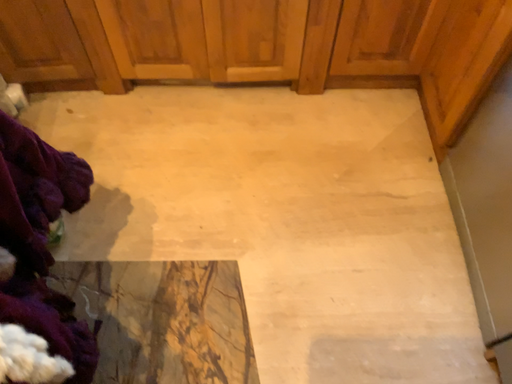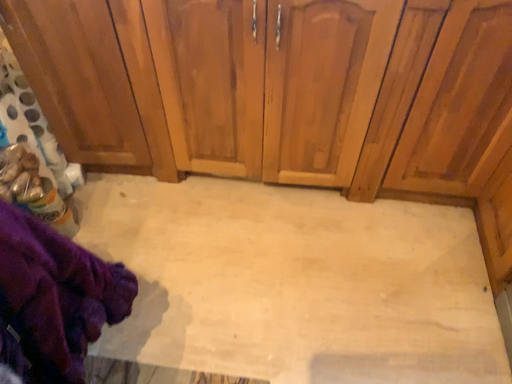
Question: Which way did the camera rotate in the video?

Choices:
 (A) rotated downward
 (B) rotated upward

Answer: (B)